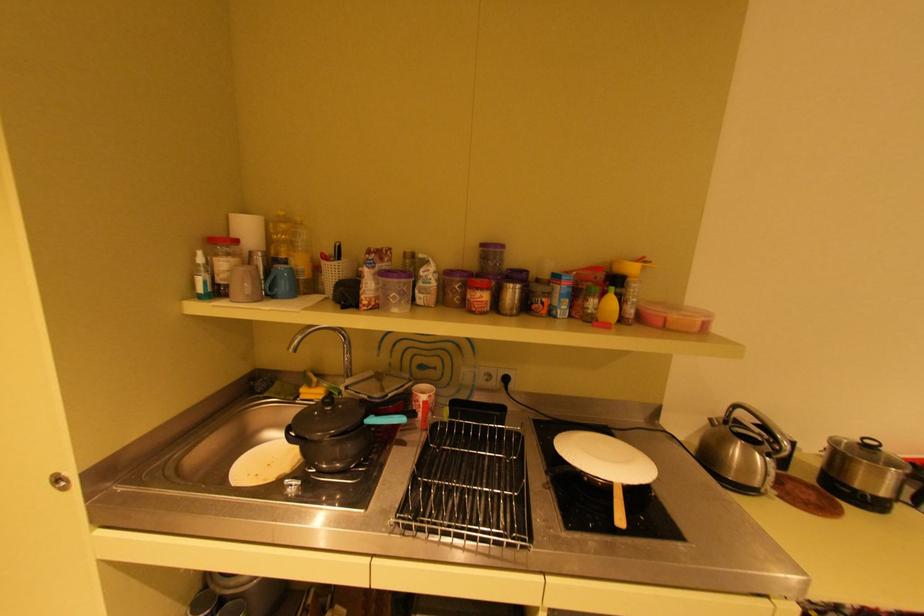
The location [422,403] corresponds to which object?

It corresponds to the red and white cup in the image.